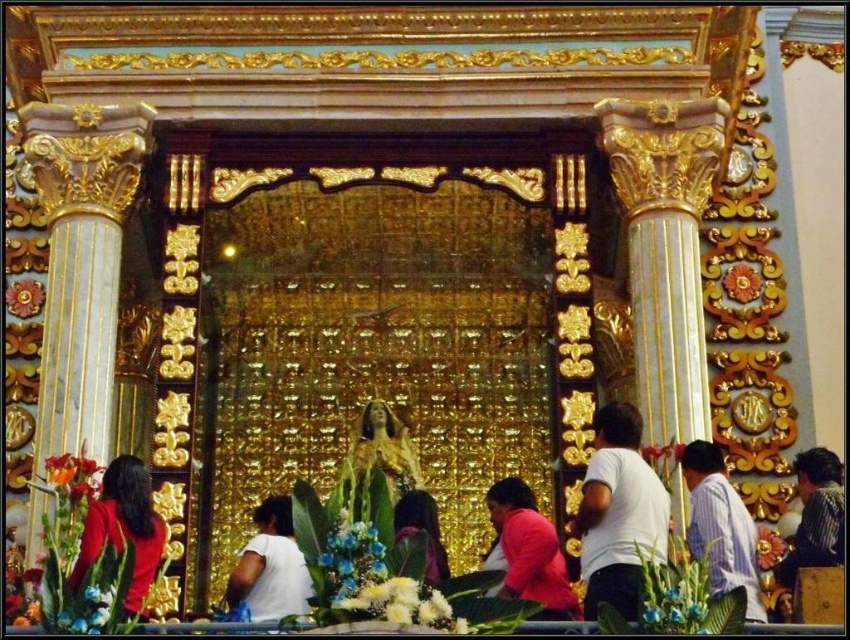
You are standing in the church and see two people wearing striped shirts. One is wearing a striped fabric shirt at right and the other a striped shirt at lower right. Which striped shirt is on the left side?

The striped fabric shirt at right is positioned on the left side of striped shirt at lower right.

What is the object located at the coordinates point (720, 525) in the image?

The point (720, 525) corresponds to the striped fabric shirt at right.